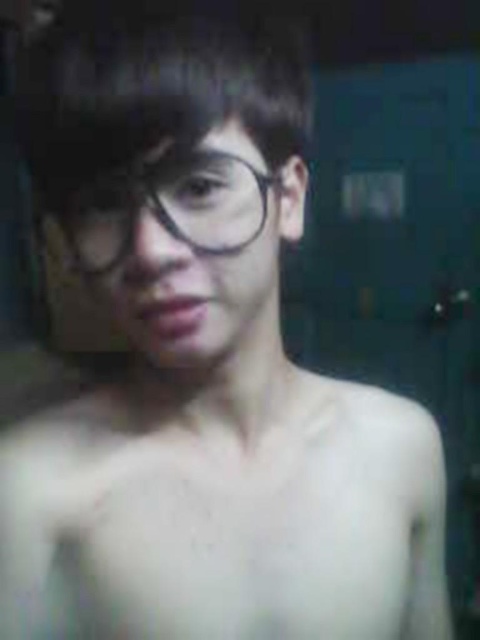
You are standing 30 inches away from the image. Can you see the point at coordinate point (369, 582) clearly?

The distance of point (369, 582) from viewer is 21.78 inches, so yes, you can see the point at coordinate point (369, 582) clearly since it is within your 30 inches viewing distance.